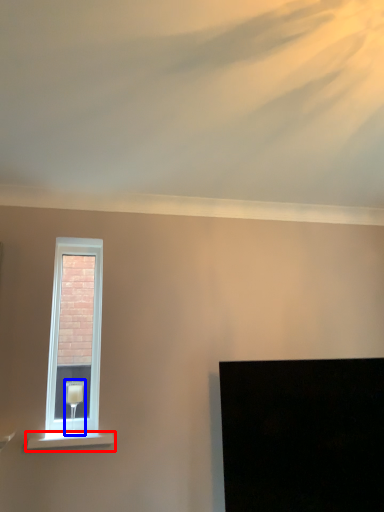
Question: Which object appears closest to the camera in this image, window sill (highlighted by a red box) or table lamp (highlighted by a blue box)?

Choices:
 (A) window sill
 (B) table lamp

Answer: (A)